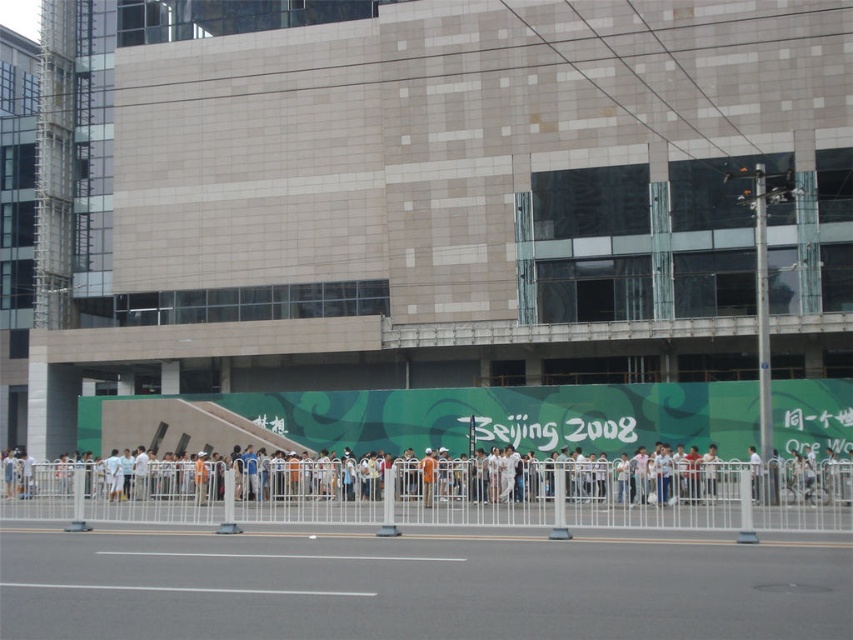
Question: Can you confirm if white metal fence at center is positioned above transparent plastic line at center?

Choices:
 (A) yes
 (B) no

Answer: (B)

Question: Which of the following is the closest to the observer?

Choices:
 (A) white glossy line at center
 (B) white metal fence at center

Answer: (A)

Question: Which is farther from the transparent plastic line at center?

Choices:
 (A) white glossy line at center
 (B) white metal fence at center

Answer: (B)

Question: Is white metal fence at center below transparent plastic line at center?

Choices:
 (A) no
 (B) yes

Answer: (B)

Question: Which object is positioned farthest from the white glossy line at center?

Choices:
 (A) white metal fence at center
 (B) transparent plastic line at center

Answer: (A)

Question: Does white metal fence at center appear on the right side of transparent plastic line at center?

Choices:
 (A) yes
 (B) no

Answer: (B)